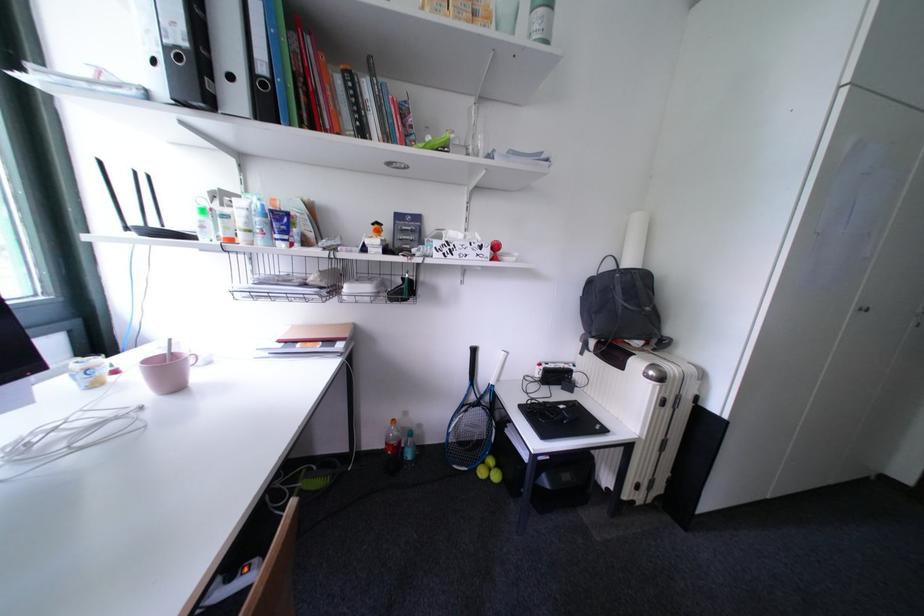
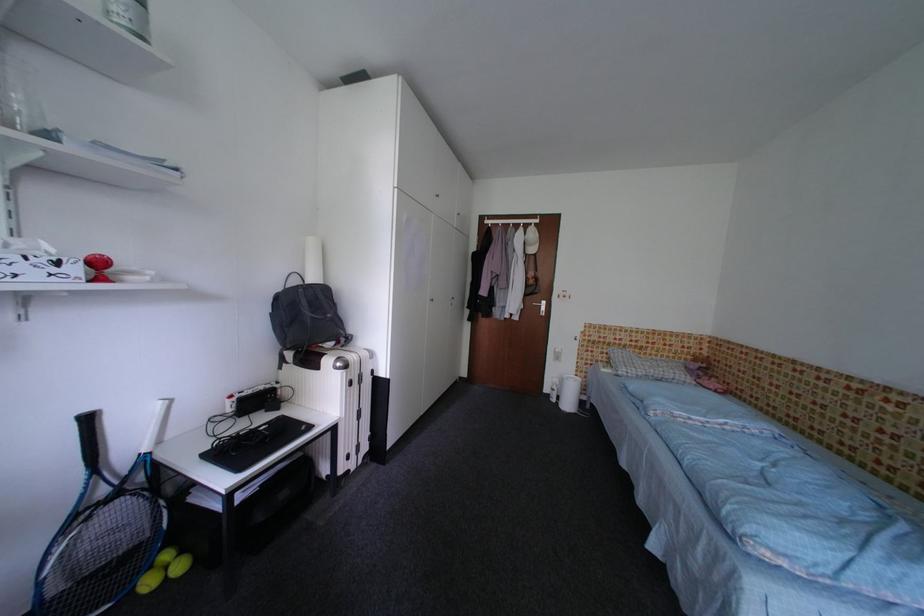
Locate, in the second image, the point that corresponds to point (565, 397) in the first image.

(270, 421)